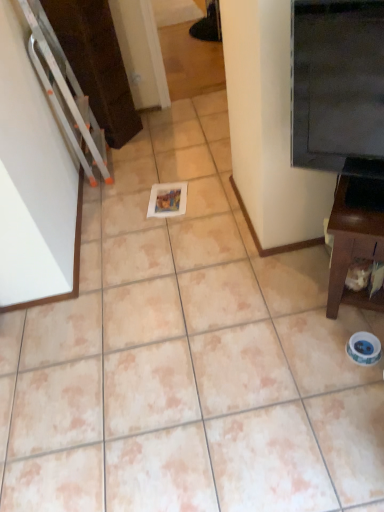
Question: Considering the positions of brown wood tv stand at right and black glossy fridge at upper right in the image, is brown wood tv stand at right taller or shorter than black glossy fridge at upper right?

Choices:
 (A) tall
 (B) short

Answer: (B)

Question: Considering the positions of brown wood tv stand at right and black glossy fridge at upper right in the image, is brown wood tv stand at right bigger or smaller than black glossy fridge at upper right?

Choices:
 (A) small
 (B) big

Answer: (B)

Question: From a real-world perspective, relative to black glossy fridge at upper right, is brown wood tv stand at right vertically above or below?

Choices:
 (A) below
 (B) above

Answer: (A)

Question: From the image's perspective, relative to brown wood tv stand at right, is black glossy fridge at upper right above or below?

Choices:
 (A) below
 (B) above

Answer: (B)

Question: In the image, is black glossy fridge at upper right on the left side or the right side of brown wood tv stand at right?

Choices:
 (A) left
 (B) right

Answer: (A)

Question: Relative to brown wood tv stand at right, is black glossy fridge at upper right in front or behind?

Choices:
 (A) behind
 (B) front

Answer: (B)

Question: From a real-world perspective, is black glossy fridge at upper right above or below brown wood tv stand at right?

Choices:
 (A) above
 (B) below

Answer: (A)